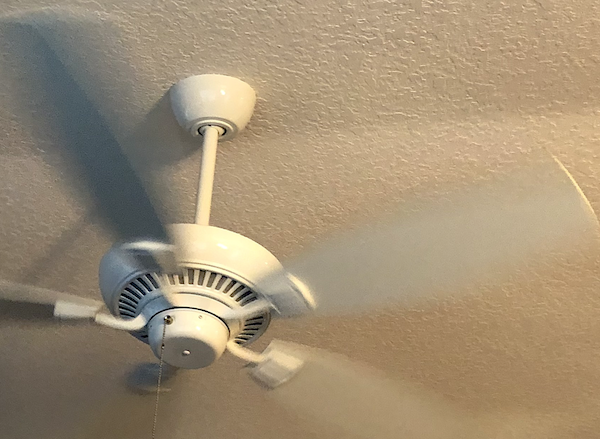
Point to the where the fan mounts to the ceiling in the image. Your answer should be formatted as a list of tuples, i.e. [(x1, y1), (x2, y2), ...], where each tuple contains the x and y coordinates of a point satisfying the conditions above.

[(175, 83), (229, 77), (254, 92)]